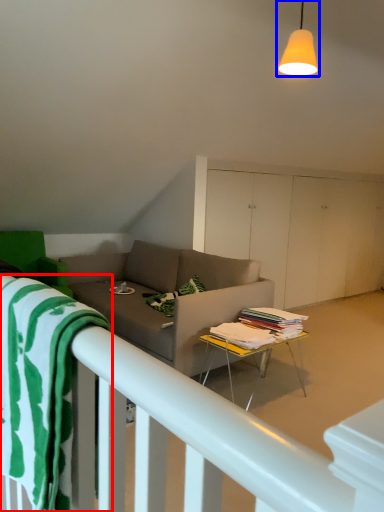
Question: Which object appears closest to the camera in this image, beach towel (highlighted by a red box) or light fixture (highlighted by a blue box)?

Choices:
 (A) beach towel
 (B) light fixture

Answer: (A)